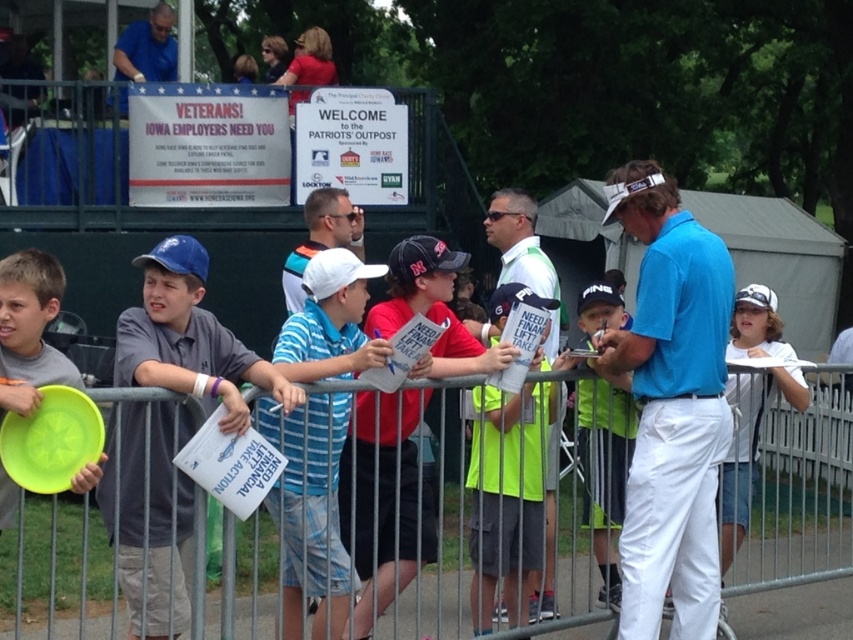
In the scene shown: Measure the distance between blue striped shirt at center and neon yellow shirt at center.

blue striped shirt at center is 35.50 inches from neon yellow shirt at center.

Can you confirm if blue striped shirt at center is positioned above neon yellow shirt at center?

No.

Which is in front, point (262, 401) or point (491, 458)?

Positioned in front is point (262, 401).

This screenshot has width=853, height=640. Identify the location of blue striped shirt at center. (311, 512).

Between metallic silver fence at center and gray matte shirt at left, which one is positioned higher?

Positioned higher is gray matte shirt at left.

Does metallic silver fence at center lie in front of gray matte shirt at left?

Yes, it is in front of gray matte shirt at left.

The image size is (853, 640). What do you see at coordinates (194, 524) in the screenshot? I see `metallic silver fence at center` at bounding box center [194, 524].

This screenshot has height=640, width=853. What are the coordinates of `metallic silver fence at center` in the screenshot? It's located at (194, 524).

Which is in front, point (486, 458) or point (83, 467)?

Positioned in front is point (83, 467).

Between point (514, 573) and point (10, 484), which one is positioned in front?

Point (10, 484) is more forward.

Where is `neon yellow shirt at center`? The height and width of the screenshot is (640, 853). neon yellow shirt at center is located at coordinates (506, 493).